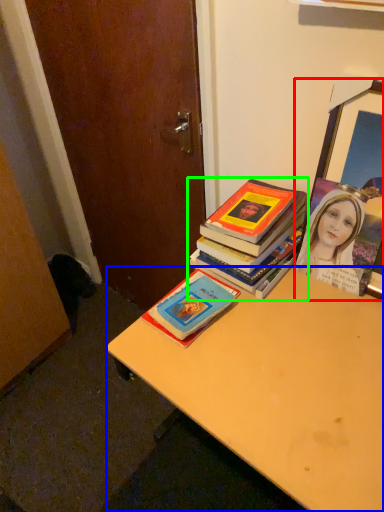
Question: Which is farther away from picture frame (highlighted by a red box)? desk (highlighted by a blue box) or book (highlighted by a green box)?

Choices:
 (A) desk
 (B) book

Answer: (A)